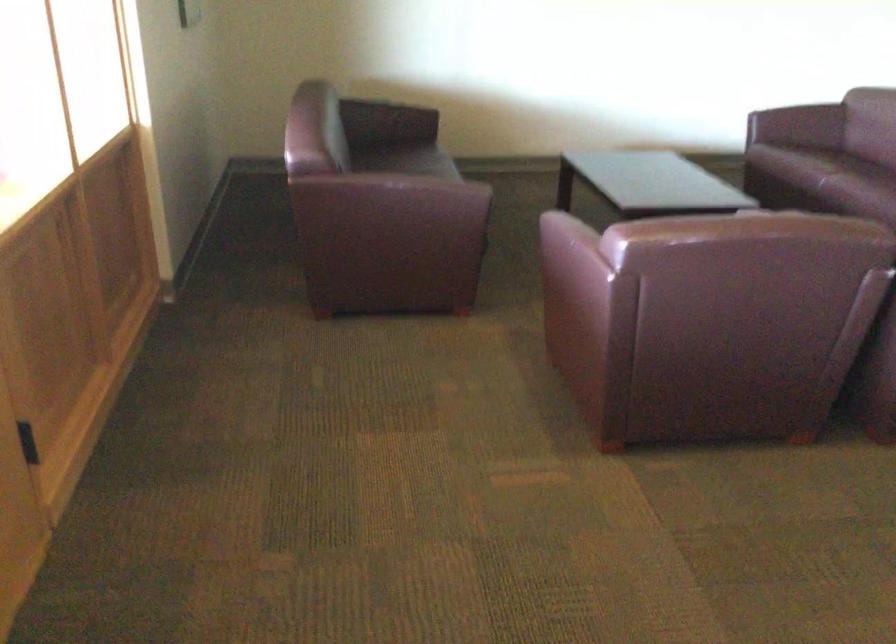
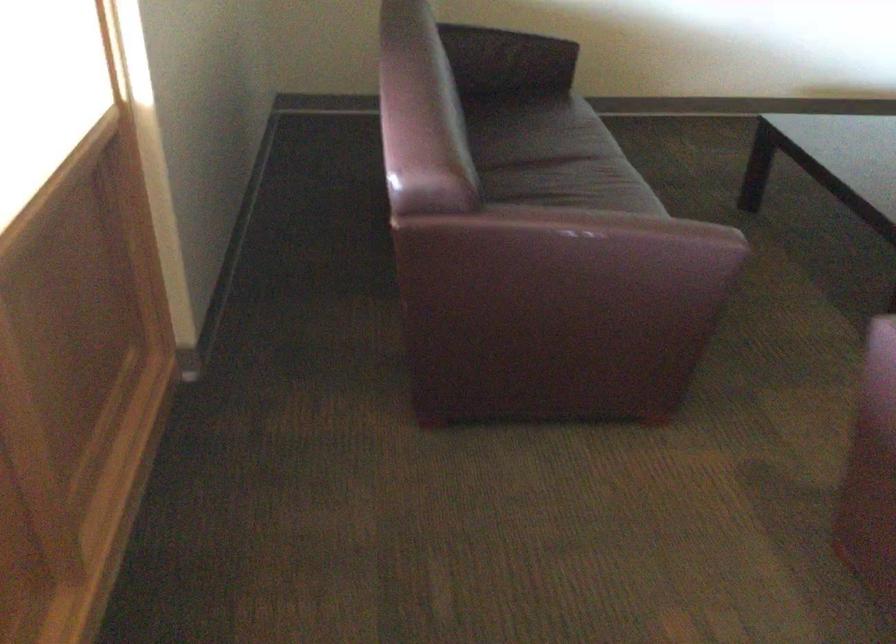
Consider the image. Based on the continuous images, in which direction is the camera rotating?

The camera's rotation is toward right-down.